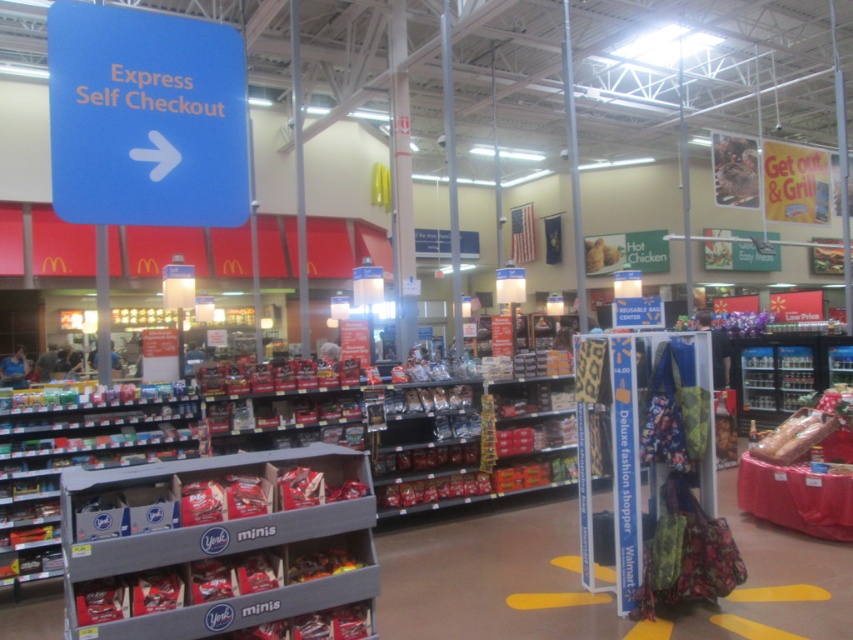
Does blue plastic sign at upper left lie behind golden crispy chicken at center?

No, blue plastic sign at upper left is closer to the viewer.

The width and height of the screenshot is (853, 640). What do you see at coordinates (144, 116) in the screenshot? I see `blue plastic sign at upper left` at bounding box center [144, 116].

Between point (70, 209) and point (616, 266), which one is positioned behind?

Point (616, 266)

Image resolution: width=853 pixels, height=640 pixels. In order to click on blue plastic sign at upper left in this screenshot , I will do `click(144, 116)`.

Does blue plastic sign at upper left have a larger size compared to shiny metallic candy at center?

Correct, blue plastic sign at upper left is larger in size than shiny metallic candy at center.

Is blue plastic sign at upper left wider than shiny metallic candy at center?

Yes, blue plastic sign at upper left is wider than shiny metallic candy at center.

What do you see at coordinates (144, 116) in the screenshot? The height and width of the screenshot is (640, 853). I see `blue plastic sign at upper left` at bounding box center [144, 116].

At what (x,y) coordinates should I click in order to perform the action: click on blue plastic sign at upper left. Please return your answer as a coordinate pair (x, y). Looking at the image, I should click on (144, 116).

Which is more to the left, blue plastic sign at upper left or shiny plastic baguette at right?

From the viewer's perspective, blue plastic sign at upper left appears more on the left side.

Who is more distant from viewer, (105,214) or (828,458)?

Positioned behind is point (828,458).

The image size is (853, 640). I want to click on blue plastic sign at upper left, so click(144, 116).